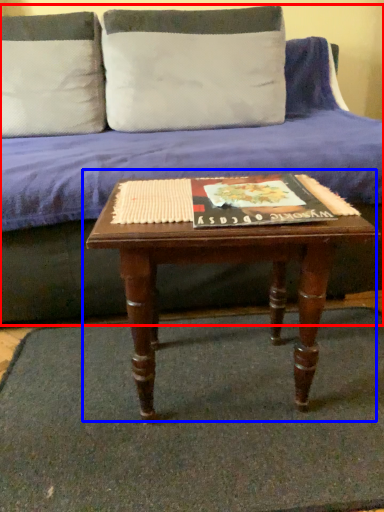
Question: Which object appears closest to the camera in this image, studio couch (highlighted by a red box) or coffee table (highlighted by a blue box)?

Choices:
 (A) studio couch
 (B) coffee table

Answer: (B)